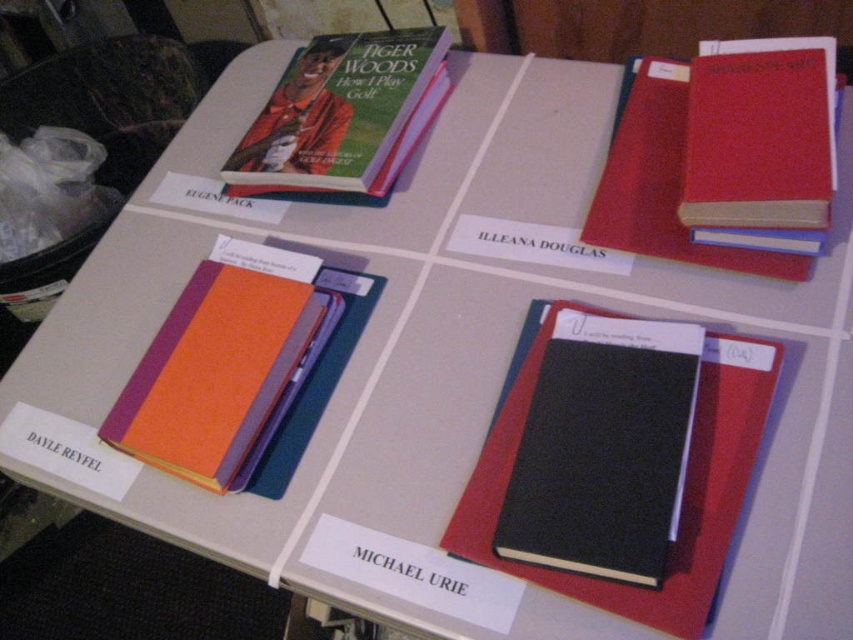
Which is below, black matte notebook at center-right or red matte book at upper right?

Positioned lower is black matte notebook at center-right.

Is point (612, 433) farther from viewer compared to point (625, 198)?

No, (612, 433) is in front of (625, 198).

You are a GUI agent. You are given a task and a screenshot of the screen. Output one action in this format:
    pyautogui.click(x=<x>, y=<y>)
    Task: Click on the black matte notebook at center-right
    Image resolution: width=853 pixels, height=640 pixels.
    Given the screenshot: What is the action you would take?
    pyautogui.click(x=602, y=449)

Can you confirm if orange fabric binder at lower left is bigger than hardcover book at upper left?

Actually, orange fabric binder at lower left might be smaller than hardcover book at upper left.

Who is positioned more to the left, orange fabric binder at lower left or hardcover book at upper left?

Positioned to the left is orange fabric binder at lower left.

Image resolution: width=853 pixels, height=640 pixels. In order to click on orange fabric binder at lower left in this screenshot , I will do `click(213, 372)`.

Measure the distance between orange fabric binder at lower left and red matte book at upper right.

orange fabric binder at lower left is 16.11 inches away from red matte book at upper right.

Is point (221, 458) positioned before point (672, 209)?

Yes.

Who is more distant from viewer, (166, 428) or (628, 204)?

Positioned behind is point (628, 204).

Where is `orange fabric binder at lower left`? This screenshot has width=853, height=640. orange fabric binder at lower left is located at coordinates (x=213, y=372).